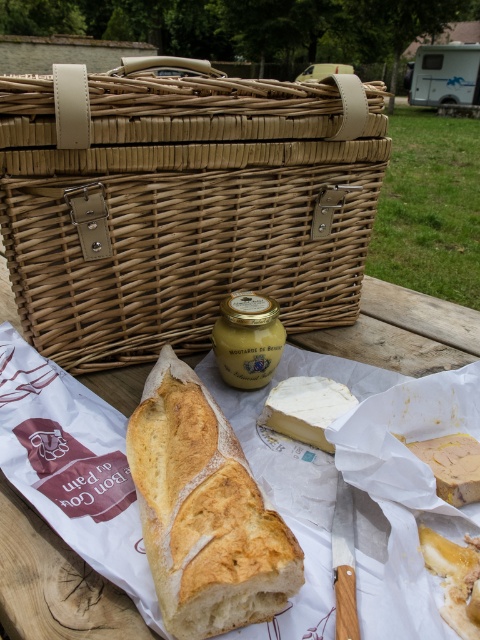
You are a food delivery robot with a 6 inch wide arm. You need to place a plate between the woven wood picnic basket at upper center and the golden brown crusty loaf of bread at center. Can your arm fit through the space between them?

The distance between the woven wood picnic basket at upper center and the golden brown crusty loaf of bread at center is 7.89 inches. Since your arm is 6 inches wide, it can fit through the space between them.

You are planning to place a 10 inch long sandwich between the woven wood picnic basket at upper center and the white creamy cheese at center. Is there enough space for the sandwich?

The distance between the woven wood picnic basket at upper center and the white creamy cheese at center is 8.27 inches. Since the sandwich is 10 inches long, it would not fit between them as the space is smaller than the sandwich.

You are planning to place both the golden brown crusty loaf of bread at center and the white creamy cheese at center into a rectangular container. The container is exactly the width of the loaf. Will the cheese fit horizontally alongside the bread?

The golden brown crusty loaf of bread at center might be wider than the white creamy cheese at center. Since the container is exactly the width of the loaf, the cheese may fit alongside if it is narrower, but there is uncertainty due to the comparative width mentioned.